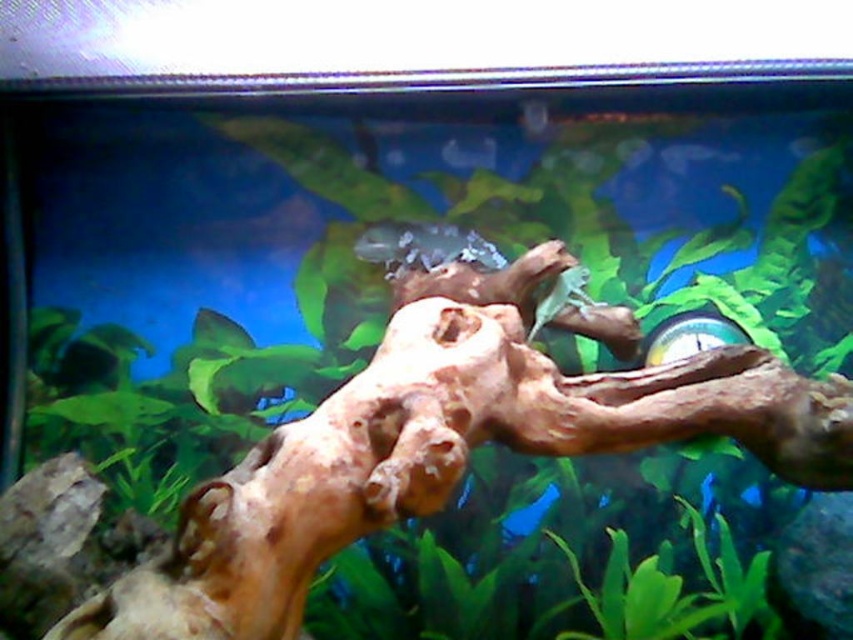
Question: Is translucent glass fish at center positioned behind translucent plastic fish at center?

Choices:
 (A) no
 (B) yes

Answer: (A)

Question: Can you confirm if translucent glass fish at center is thinner than translucent plastic fish at center?

Choices:
 (A) no
 (B) yes

Answer: (A)

Question: Among these objects, which one is farthest from the camera?

Choices:
 (A) translucent plastic fish at center
 (B) translucent glass fish at center

Answer: (A)

Question: Which of the following is the closest to the observer?

Choices:
 (A) 465,154
 (B) 424,221

Answer: (B)

Question: Is translucent glass fish at center to the left of translucent plastic fish at center from the viewer's perspective?

Choices:
 (A) yes
 (B) no

Answer: (A)

Question: Which point is farther to the camera?

Choices:
 (A) 474,154
 (B) 399,260

Answer: (A)